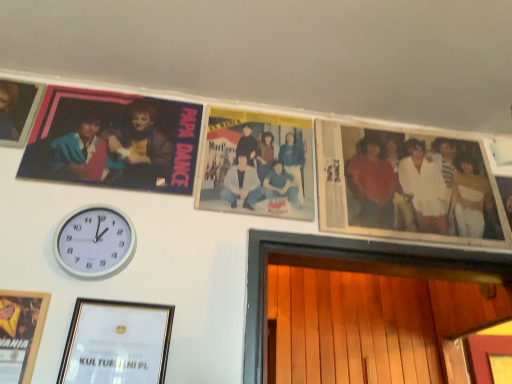
Locate an element on the screen. The width and height of the screenshot is (512, 384). white cotton shirt at right is located at coordinates (419, 185).

What is the approximate height of gold-framed certificate at lower left, the fourth picture frame when ordered from top to bottom?

gold-framed certificate at lower left, the fourth picture frame when ordered from top to bottom, is 13.12 inches in height.

What do you see at coordinates (94, 241) in the screenshot?
I see `white plastic wall clock at lower left` at bounding box center [94, 241].

This screenshot has width=512, height=384. What are the coordinates of `wooden picture frame at lower left, which is counted as the 2th picture frame, starting from the bottom` in the screenshot? It's located at (20, 333).

Consider the image. Between white plastic wall clock at lower left and matte black photo frame at upper left, positioned as the first picture frame in top-to-bottom order, which one appears on the left side from the viewer's perspective?

From the viewer's perspective, matte black photo frame at upper left, positioned as the first picture frame in top-to-bottom order, appears more on the left side.

From a real-world perspective, which object stands above the other?

matte black photo frame at upper left, which is the fourth picture frame from bottom to top.

Considering the sizes of objects white plastic wall clock at lower left and matte black photo frame at upper left, which is the fourth picture frame from bottom to top, in the image provided, who is taller, white plastic wall clock at lower left or matte black photo frame at upper left, which is the fourth picture frame from bottom to top,?

With more height is matte black photo frame at upper left, which is the fourth picture frame from bottom to top.

Can you tell me how much white plastic wall clock at lower left and matte black photo frame at upper left, positioned as the first picture frame in top-to-bottom order, differ in facing direction?

0.00137 degrees separate the facing orientations of white plastic wall clock at lower left and matte black photo frame at upper left, positioned as the first picture frame in top-to-bottom order.

Can we say white cotton shirt at right lies outside matte black photo frame at upper left, which is the fourth picture frame from bottom to top?

white cotton shirt at right lies outside matte black photo frame at upper left, which is the fourth picture frame from bottom to top,'s area.

Is white cotton shirt at right not near matte black photo frame at upper left, positioned as the first picture frame in top-to-bottom order?

Yes, white cotton shirt at right is far from matte black photo frame at upper left, positioned as the first picture frame in top-to-bottom order.

Does white cotton shirt at right have a lesser width compared to matte black photo frame at upper left, positioned as the first picture frame in top-to-bottom order?

Indeed, white cotton shirt at right has a lesser width compared to matte black photo frame at upper left, positioned as the first picture frame in top-to-bottom order.

Considering their positions, is white cotton shirt at right located in front of or behind matte black photo frame at upper left, positioned as the first picture frame in top-to-bottom order?

In the image, white cotton shirt at right appears behind matte black photo frame at upper left, positioned as the first picture frame in top-to-bottom order.

Looking at this image, considering the sizes of matte black photo frame at upper left, positioned as the first picture frame in top-to-bottom order, and gold-framed certificate at lower left, the fourth picture frame when ordered from top to bottom, in the image, is matte black photo frame at upper left, positioned as the first picture frame in top-to-bottom order, wider or thinner than gold-framed certificate at lower left, the fourth picture frame when ordered from top to bottom,?

In the image, matte black photo frame at upper left, positioned as the first picture frame in top-to-bottom order, appears to be wider than gold-framed certificate at lower left, the fourth picture frame when ordered from top to bottom.

Considering the sizes of matte black photo frame at upper left, which is the fourth picture frame from bottom to top, and gold-framed certificate at lower left, the fourth picture frame when ordered from top to bottom, in the image, is matte black photo frame at upper left, which is the fourth picture frame from bottom to top, bigger or smaller than gold-framed certificate at lower left, the fourth picture frame when ordered from top to bottom,?

Considering their sizes, matte black photo frame at upper left, which is the fourth picture frame from bottom to top, takes up more space than gold-framed certificate at lower left, the fourth picture frame when ordered from top to bottom.

Considering the relative positions of matte black photo frame at upper left, positioned as the first picture frame in top-to-bottom order, and gold-framed certificate at lower left, the fourth picture frame when ordered from top to bottom, in the image provided, is matte black photo frame at upper left, positioned as the first picture frame in top-to-bottom order, behind gold-framed certificate at lower left, the fourth picture frame when ordered from top to bottom,?

Yes, matte black photo frame at upper left, positioned as the first picture frame in top-to-bottom order, is further from the camera.

Is matte black photo frame at upper left, positioned as the first picture frame in top-to-bottom order, looking in the opposite direction of gold-framed certificate at lower left, the fourth picture frame when ordered from top to bottom?

No, gold-framed certificate at lower left, the fourth picture frame when ordered from top to bottom, is not at the back of matte black photo frame at upper left, positioned as the first picture frame in top-to-bottom order.

Which of these two, gold-framed certificate at lower left, the fourth picture frame when ordered from top to bottom, or white plastic wall clock at lower left, is smaller?

white plastic wall clock at lower left.

From a real-world perspective, does gold-framed certificate at lower left, the 1th picture frame ordered from the bottom, stand above white plastic wall clock at lower left?

No, from a real-world perspective, gold-framed certificate at lower left, the 1th picture frame ordered from the bottom, is not over white plastic wall clock at lower left

Could you measure the distance between gold-framed certificate at lower left, the fourth picture frame when ordered from top to bottom, and white plastic wall clock at lower left?

6.67 inches.

Can you confirm if white cotton shirt at right is smaller than wooden picture frame at lower left, arranged as the 3th picture frame when viewed from the top?

No.

From the image's perspective, would you say white cotton shirt at right is shown under wooden picture frame at lower left, arranged as the 3th picture frame when viewed from the top?

No.

From a real-world perspective, between white cotton shirt at right and wooden picture frame at lower left, which is counted as the 2th picture frame, starting from the bottom, who is vertically lower?

wooden picture frame at lower left, which is counted as the 2th picture frame, starting from the bottom, from a real-world perspective.

Can you confirm if white cotton shirt at right is positioned to the right of wooden picture frame at lower left, which is counted as the 2th picture frame, starting from the bottom?

Yes.

Considering the relative sizes of wooden picture frame at lower left, which is counted as the 2th picture frame, starting from the bottom, and matte plastic photo frame at upper left, which is counted as the 3th picture frame, starting from the bottom, in the image provided, is wooden picture frame at lower left, which is counted as the 2th picture frame, starting from the bottom, thinner than matte plastic photo frame at upper left, which is counted as the 3th picture frame, starting from the bottom,?

Indeed, wooden picture frame at lower left, which is counted as the 2th picture frame, starting from the bottom, has a lesser width compared to matte plastic photo frame at upper left, which is counted as the 3th picture frame, starting from the bottom.

Is wooden picture frame at lower left, which is counted as the 2th picture frame, starting from the bottom, oriented towards matte plastic photo frame at upper left, which is counted as the 3th picture frame, starting from the bottom?

No, wooden picture frame at lower left, which is counted as the 2th picture frame, starting from the bottom, is not oriented towards matte plastic photo frame at upper left, which is counted as the 3th picture frame, starting from the bottom.

Considering the positions of points (18, 294) and (104, 127), is point (18, 294) closer to camera compared to point (104, 127)?

Yes, it is.

Which of these two, wooden picture frame at lower left, arranged as the 3th picture frame when viewed from the top, or matte plastic photo frame at upper left, the 2th picture frame when ordered from top to bottom, is smaller?

Smaller between the two is wooden picture frame at lower left, arranged as the 3th picture frame when viewed from the top.

Is gold-framed certificate at lower left, the 1th picture frame ordered from the bottom, turned away from matte black photo frame at upper left, positioned as the first picture frame in top-to-bottom order?

No, gold-framed certificate at lower left, the 1th picture frame ordered from the bottom, is not facing the opposite direction of matte black photo frame at upper left, positioned as the first picture frame in top-to-bottom order.

At what (x,y) coordinates should I click in order to perform the action: click on picture frame that is the 2nd object above the gold-framed certificate at lower left, the 1th picture frame ordered from the bottom (from a real-world perspective). Please return your answer as a coordinate pair (x, y). This screenshot has height=384, width=512. Looking at the image, I should click on (18, 111).

Is gold-framed certificate at lower left, the fourth picture frame when ordered from top to bottom, bigger than matte black photo frame at upper left, which is the fourth picture frame from bottom to top?

Incorrect, gold-framed certificate at lower left, the fourth picture frame when ordered from top to bottom, is not larger than matte black photo frame at upper left, which is the fourth picture frame from bottom to top.

Is gold-framed certificate at lower left, the fourth picture frame when ordered from top to bottom, directly adjacent to matte black photo frame at upper left, positioned as the first picture frame in top-to-bottom order?

gold-framed certificate at lower left, the fourth picture frame when ordered from top to bottom, and matte black photo frame at upper left, positioned as the first picture frame in top-to-bottom order, are not in contact.

Where is `wall clock below the matte black photo frame at upper left, positioned as the first picture frame in top-to-bottom order (from the image's perspective)`? The width and height of the screenshot is (512, 384). wall clock below the matte black photo frame at upper left, positioned as the first picture frame in top-to-bottom order (from the image's perspective) is located at coordinates (94, 241).

Locate an element on the screen. The height and width of the screenshot is (384, 512). person below the matte black photo frame at upper left, which is the fourth picture frame from bottom to top (from a real-world perspective) is located at coordinates (419, 185).

Estimate the real-world distances between objects in this image. Which object is closer to matte black photo frame at upper left, positioned as the first picture frame in top-to-bottom order, gold-framed certificate at lower left, the 1th picture frame ordered from the bottom, or white cotton shirt at right?

gold-framed certificate at lower left, the 1th picture frame ordered from the bottom.

Based on their spatial positions, is matte plastic photo frame at upper left, the 2th picture frame when ordered from top to bottom, or gold-framed certificate at lower left, the 1th picture frame ordered from the bottom, closer to white plastic wall clock at lower left?

gold-framed certificate at lower left, the 1th picture frame ordered from the bottom, is closer to white plastic wall clock at lower left.

Estimate the real-world distances between objects in this image. Which object is further from gold-framed certificate at lower left, the 1th picture frame ordered from the bottom, white plastic wall clock at lower left or white cotton shirt at right?

Among the two, white cotton shirt at right is located further to gold-framed certificate at lower left, the 1th picture frame ordered from the bottom.

When comparing their distances from white plastic wall clock at lower left, does matte black photo frame at upper left, which is the fourth picture frame from bottom to top, or wooden picture frame at lower left, which is counted as the 2th picture frame, starting from the bottom, seem further?

matte black photo frame at upper left, which is the fourth picture frame from bottom to top.

From the image, which object appears to be farther from matte black photo frame at upper left, positioned as the first picture frame in top-to-bottom order, wooden picture frame at lower left, which is counted as the 2th picture frame, starting from the bottom, or white plastic wall clock at lower left?

wooden picture frame at lower left, which is counted as the 2th picture frame, starting from the bottom.

When comparing their distances from white cotton shirt at right, does white plastic wall clock at lower left or wooden picture frame at lower left, arranged as the 3th picture frame when viewed from the top, seem further?

wooden picture frame at lower left, arranged as the 3th picture frame when viewed from the top, is further to white cotton shirt at right.

Looking at this image, considering their positions, is white plastic wall clock at lower left positioned closer to white cotton shirt at right than gold-framed certificate at lower left, the 1th picture frame ordered from the bottom?

gold-framed certificate at lower left, the 1th picture frame ordered from the bottom, is positioned closer to the anchor white cotton shirt at right.

Estimate the real-world distances between objects in this image. Which object is closer to matte black photo frame at upper left, which is the fourth picture frame from bottom to top, wooden picture frame at lower left, which is counted as the 2th picture frame, starting from the bottom, or matte plastic photo frame at upper left, which is counted as the 3th picture frame, starting from the bottom?

matte plastic photo frame at upper left, which is counted as the 3th picture frame, starting from the bottom, is closer to matte black photo frame at upper left, which is the fourth picture frame from bottom to top.

Find the location of `wall clock between matte black photo frame at upper left, which is the fourth picture frame from bottom to top, and gold-framed certificate at lower left, the 1th picture frame ordered from the bottom, from top to bottom`. wall clock between matte black photo frame at upper left, which is the fourth picture frame from bottom to top, and gold-framed certificate at lower left, the 1th picture frame ordered from the bottom, from top to bottom is located at coordinates (94, 241).

The height and width of the screenshot is (384, 512). I want to click on wall clock between matte black photo frame at upper left, which is the fourth picture frame from bottom to top, and wooden picture frame at lower left, arranged as the 3th picture frame when viewed from the top, vertically, so click(94, 241).

Identify the location of picture frame between matte plastic photo frame at upper left, the 2th picture frame when ordered from top to bottom, and gold-framed certificate at lower left, the 1th picture frame ordered from the bottom, in the vertical direction. The width and height of the screenshot is (512, 384). (20, 333).

The image size is (512, 384). I want to click on picture frame that lies between matte black photo frame at upper left, which is the fourth picture frame from bottom to top, and wooden picture frame at lower left, arranged as the 3th picture frame when viewed from the top, from top to bottom, so click(x=113, y=141).